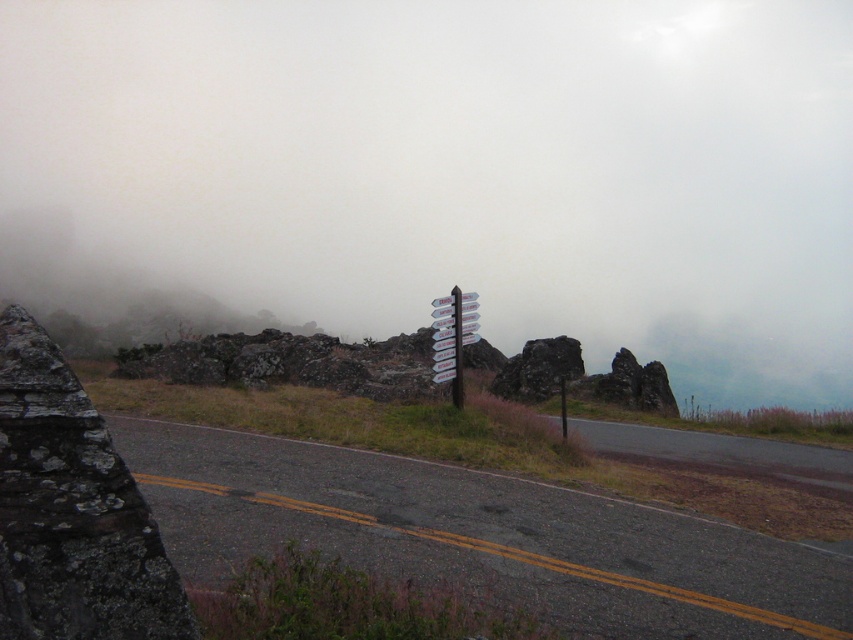
Question: Considering the relative positions of lichen-covered rock at left and white plastic pole at center in the image provided, where is lichen-covered rock at left located with respect to white plastic pole at center?

Choices:
 (A) right
 (B) left

Answer: (B)

Question: Estimate the real-world distances between objects in this image. Which object is closer to the white plastic pole at center?

Choices:
 (A) white plastic signpost at center
 (B) lichen-covered rock at left

Answer: (A)

Question: Is lichen-covered rock at left positioned at the back of white plastic pole at center?

Choices:
 (A) no
 (B) yes

Answer: (A)

Question: Based on their relative distances, which object is farther from the white plastic pole at center?

Choices:
 (A) white plastic signpost at center
 (B) lichen-covered rock at left

Answer: (B)

Question: Which of these objects is positioned closest to the white plastic signpost at center?

Choices:
 (A) lichen-covered rock at left
 (B) white plastic pole at center

Answer: (B)

Question: Does lichen-covered rock at left have a larger size compared to white plastic pole at center?

Choices:
 (A) no
 (B) yes

Answer: (B)